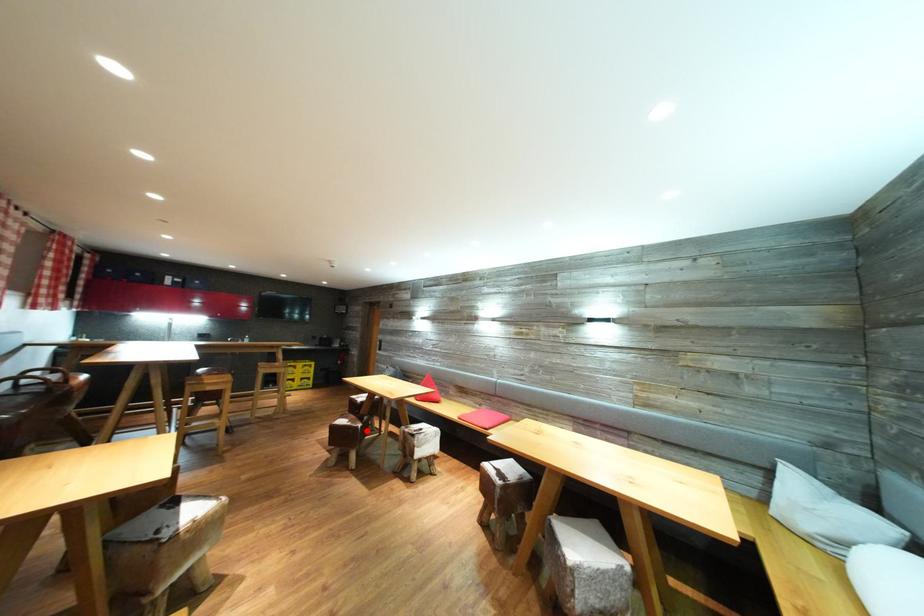
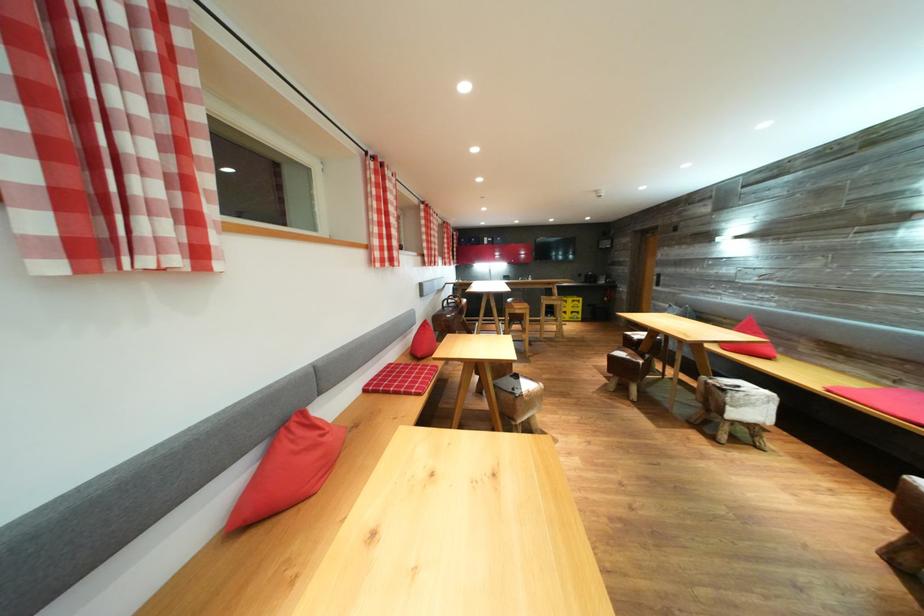
Where in the second image is the point corresponding to the highlighted location from the first image?

(648, 367)